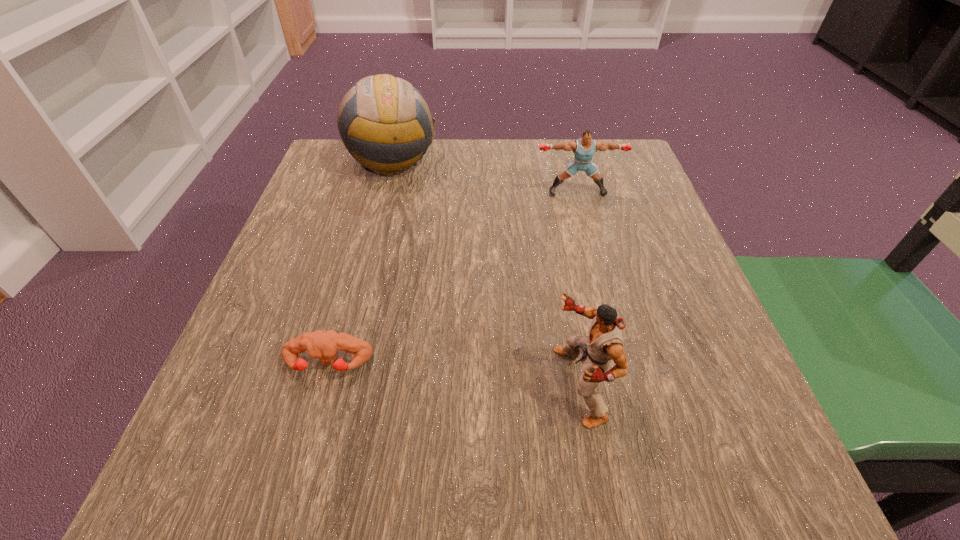
Where is `free spot between the second farthest object and the tallest puncher`? The width and height of the screenshot is (960, 540). free spot between the second farthest object and the tallest puncher is located at coordinates (578, 289).

In order to click on unoccupied position between the third nearest object and the shortest object in this screenshot , I will do `click(452, 278)`.

Identify the location of free space between the farthest object and the shortest puncher. coord(360,262).

Locate an element on the screen. vacant region between the tallest puncher and the second tallest puncher is located at coordinates (578, 289).

The width and height of the screenshot is (960, 540). In order to click on free space between the shortest object and the farthest object in this screenshot , I will do click(360, 262).

Find the location of a particular element. The image size is (960, 540). blank region between the second tallest puncher and the tallest puncher is located at coordinates (578, 289).

Where is `the closest object to the volleyball`? The width and height of the screenshot is (960, 540). the closest object to the volleyball is located at coordinates (584, 148).

This screenshot has width=960, height=540. In order to click on the closest object to the tallest puncher in this screenshot , I will do `click(319, 344)`.

Point out which puncher is positioned as the second nearest to the tallest puncher. Please provide its 2D coordinates. Your answer should be formatted as a tuple, i.e. [(x, y)], where the tuple contains the x and y coordinates of a point satisfying the conditions above.

[(584, 148)]

Identify which puncher is the third closest to the farthest object. Please provide its 2D coordinates. Your answer should be formatted as a tuple, i.e. [(x, y)], where the tuple contains the x and y coordinates of a point satisfying the conditions above.

[(605, 342)]